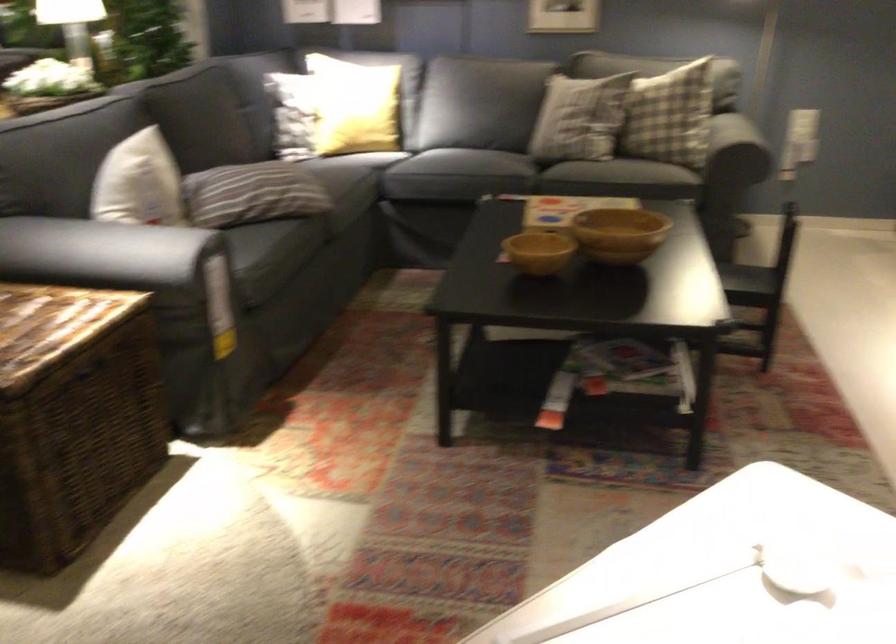
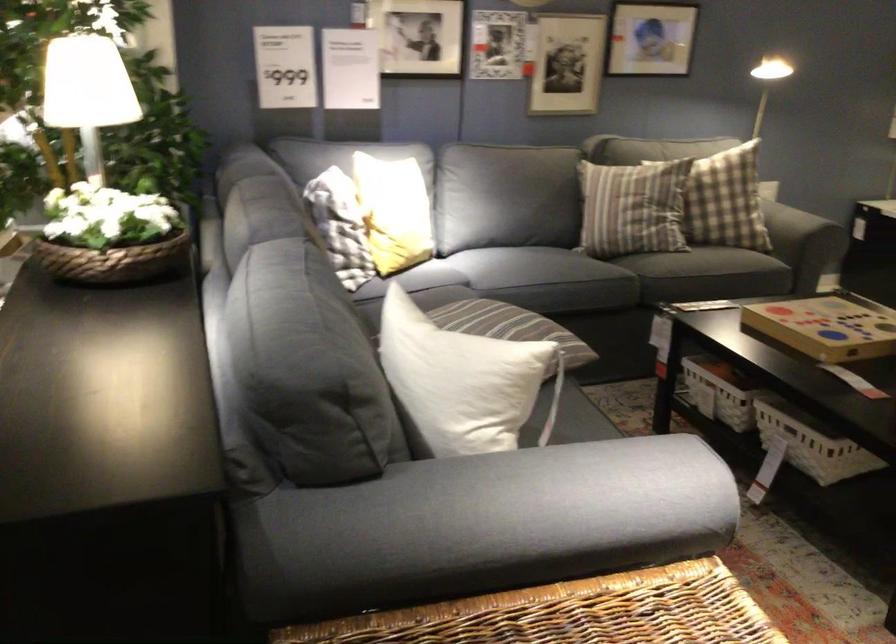
Locate, in the second image, the point that corresponds to [80,259] in the first image.

(528, 500)